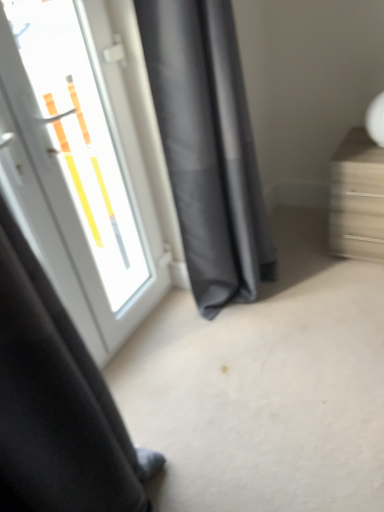
Identify the location of vacant area that lies between wooden drawer at right and dark gray fabric curtain at center. Image resolution: width=384 pixels, height=512 pixels. (305, 268).